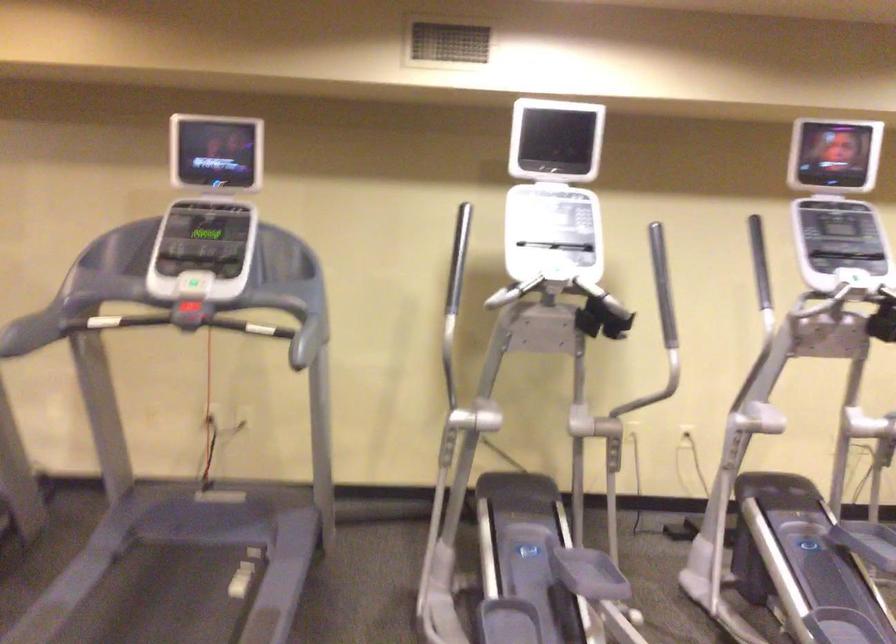
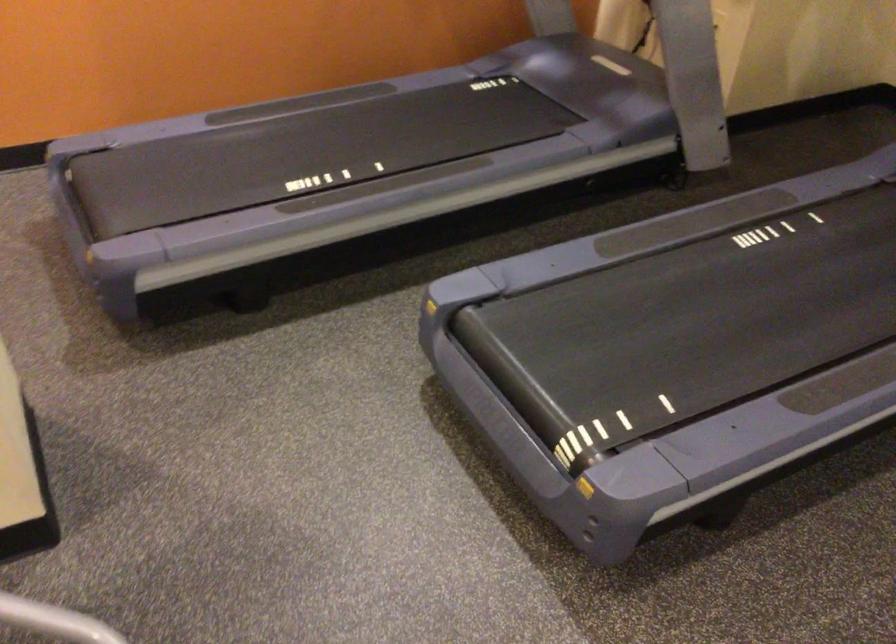
Looking at this image, the images are taken continuously from a first-person perspective. In which direction is your viewpoint rotating?

The camera rotated toward left-down.